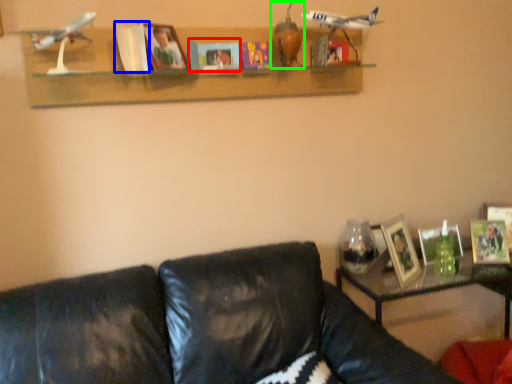
Question: Which is farther away from paperback book (highlighted by a red box)? paperback book (highlighted by a blue box) or toy (highlighted by a green box)?

Choices:
 (A) paperback book
 (B) toy

Answer: (A)